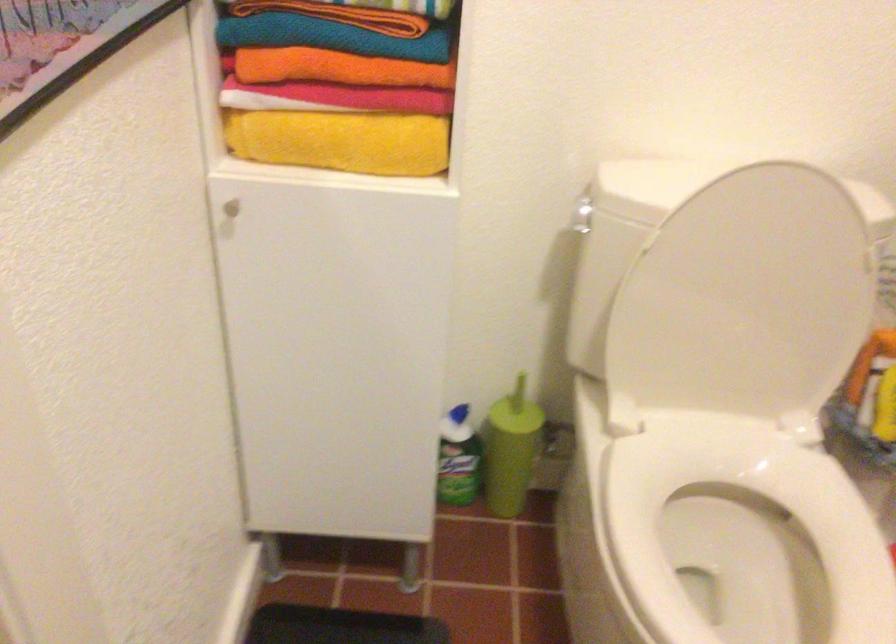
The width and height of the screenshot is (896, 644). In order to click on cabinet door knob in this screenshot , I will do `click(228, 210)`.